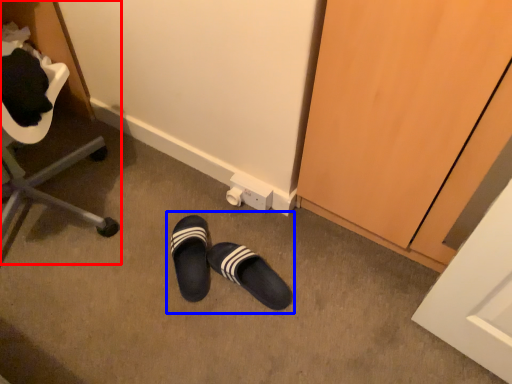
Question: Which object appears closest to the camera in this image, furniture (highlighted by a red box) or leather shoe (highlighted by a blue box)?

Choices:
 (A) furniture
 (B) leather shoe

Answer: (A)